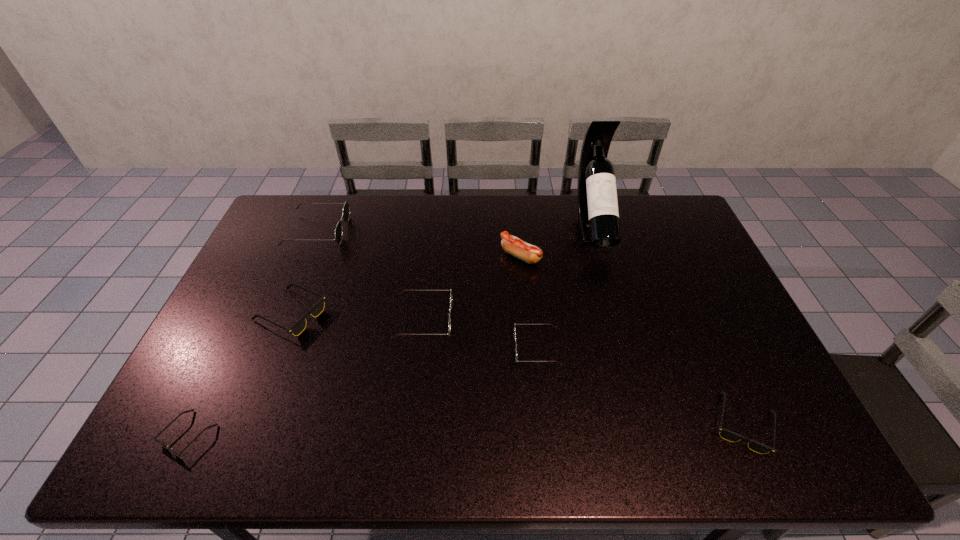
This screenshot has width=960, height=540. Identify the location of free point at the left edge. (225, 389).

In the image, there is a desktop. Where is `vacant space at the right edge`? vacant space at the right edge is located at coordinates (669, 244).

The height and width of the screenshot is (540, 960). What are the coordinates of `free point between the third sunglasses from right to left and the sausage` in the screenshot? It's located at (472, 288).

The width and height of the screenshot is (960, 540). I want to click on vacant space that is in between the sausage and the shortest object, so click(354, 346).

In order to click on free space between the rightmost black sunglasses and the rightmost green sunglasses in this screenshot , I will do `click(639, 386)`.

Where is `vacant space that's between the wine bottle and the smallest green sunglasses`? vacant space that's between the wine bottle and the smallest green sunglasses is located at coordinates (564, 287).

This screenshot has width=960, height=540. In order to click on free area in between the brown sausage and the rightmost green sunglasses in this screenshot , I will do `click(529, 302)`.

Image resolution: width=960 pixels, height=540 pixels. Identify the location of vacant area that lies between the shortest sunglasses and the seventh tallest object. (466, 429).

The image size is (960, 540). Find the location of `vacant region between the black wine bottle and the sausage`. vacant region between the black wine bottle and the sausage is located at coordinates (557, 241).

Identify the location of vacant area that lies between the farthest sunglasses and the smallest black sunglasses. (252, 333).